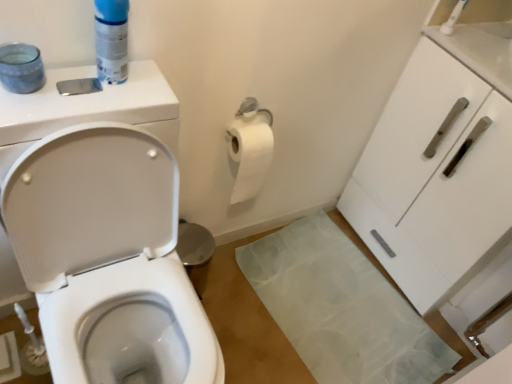
Question: Does white glossy toilet at left lie behind white glossy cabinet at right?

Choices:
 (A) no
 (B) yes

Answer: (A)

Question: Is white glossy toilet at left facing towards white glossy cabinet at right?

Choices:
 (A) yes
 (B) no

Answer: (B)

Question: Does white glossy toilet at left have a smaller size compared to white glossy cabinet at right?

Choices:
 (A) no
 (B) yes

Answer: (A)

Question: Is white glossy toilet at left bigger than white glossy cabinet at right?

Choices:
 (A) yes
 (B) no

Answer: (A)

Question: Is white glossy toilet at left surrounding white glossy cabinet at right?

Choices:
 (A) yes
 (B) no

Answer: (B)

Question: Is white glossy toilet at left not within white glossy cabinet at right?

Choices:
 (A) no
 (B) yes

Answer: (B)

Question: From a real-world perspective, does blue plastic can at upper left stand above white glossy cabinet at right?

Choices:
 (A) no
 (B) yes

Answer: (B)

Question: Can you confirm if blue plastic can at upper left is bigger than white glossy cabinet at right?

Choices:
 (A) yes
 (B) no

Answer: (B)

Question: Is blue plastic can at upper left looking in the opposite direction of white glossy cabinet at right?

Choices:
 (A) yes
 (B) no

Answer: (B)

Question: Is blue plastic can at upper left further to the viewer compared to white glossy cabinet at right?

Choices:
 (A) yes
 (B) no

Answer: (B)

Question: Considering the relative sizes of blue plastic can at upper left and white glossy cabinet at right in the image provided, is blue plastic can at upper left shorter than white glossy cabinet at right?

Choices:
 (A) yes
 (B) no

Answer: (A)

Question: Is blue plastic can at upper left positioned beyond the bounds of white glossy cabinet at right?

Choices:
 (A) no
 (B) yes

Answer: (B)

Question: Is white glossy toilet at left further to camera compared to blue plastic can at upper left?

Choices:
 (A) no
 (B) yes

Answer: (A)